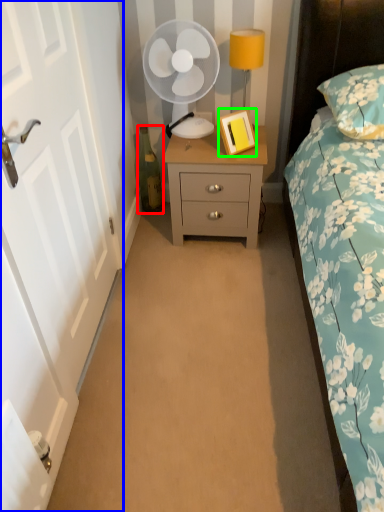
Question: Considering the real-world distances, which object is closest to bottle (highlighted by a red box)? door (highlighted by a blue box) or picture frame (highlighted by a green box).

Choices:
 (A) door
 (B) picture frame

Answer: (B)